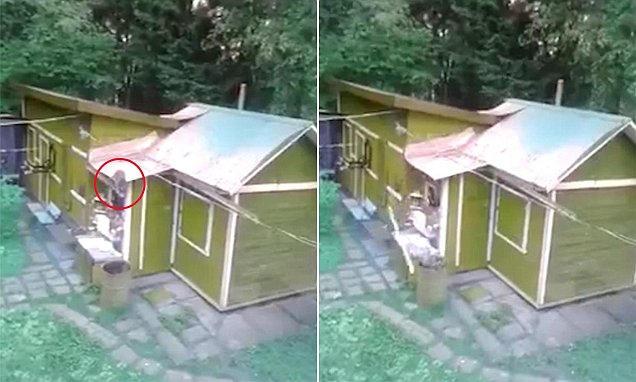
You are a GUI agent. You are given a task and a screenshot of the screen. Output one action in this format:
    pyautogui.click(x=<x>, y=<y>)
    Task: Click on the window
    The height and width of the screenshot is (382, 636).
    Given the screenshot: What is the action you would take?
    pyautogui.click(x=116, y=198)